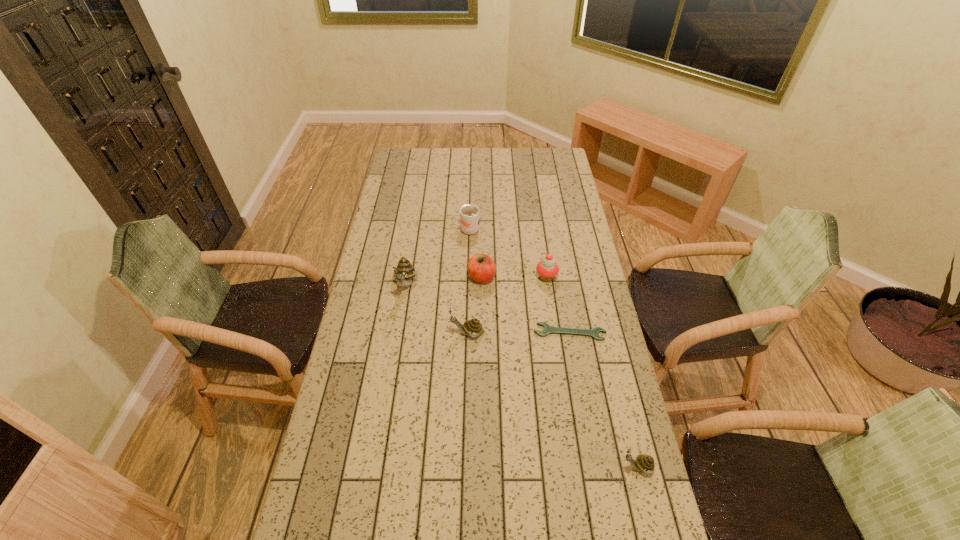
To achieve uniform spacing by inserting another escargot among them, please point to a free space for this new escargot. Please provide its 2D coordinates. Your answer should be formatted as a tuple, i.e. [(x, y)], where the tuple contains the x and y coordinates of a point satisfying the conditions above.

[(542, 393)]